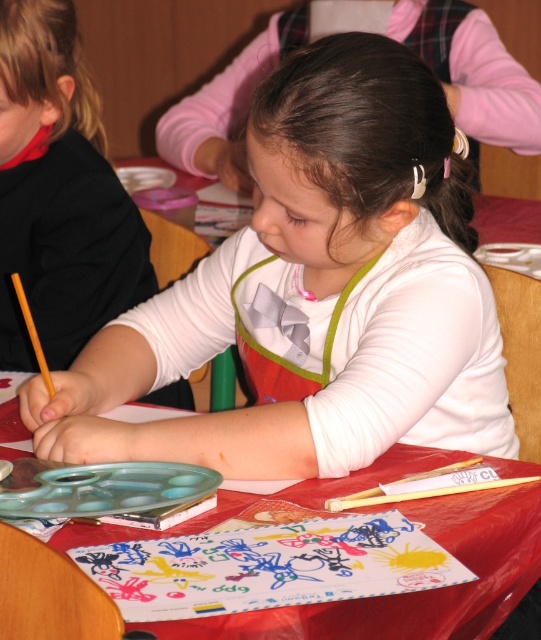
What are the coordinates of the matte white shirt at center?

The matte white shirt at center is located at coordinates point (58, 193).

You are a teacher observing the classroom. You notice a point at coordinates (58, 193). What object is located at that point?

The object at point (58, 193) is the matte white shirt at center.

Looking at this image, you are a teacher in the classroom and need to place a new art kit between the white matte apron at center and the red plastic table at center. Can the art kit, which is 12 inches long, fit in the space between them?

The distance between the white matte apron at center and the red plastic table at center is 10.55 inches. Since the art kit is 12 inches long, it cannot fit in the available space.